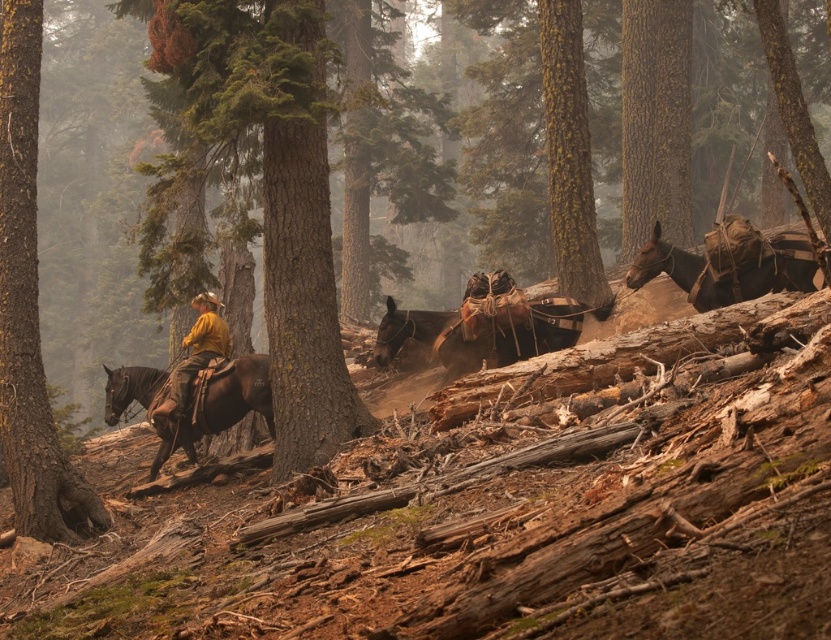
Question: Is brown leather horse at right to the left of yellow matte shirt at left from the viewer's perspective?

Choices:
 (A) yes
 (B) no

Answer: (B)

Question: Which of the following is the farthest from the observer?

Choices:
 (A) (180, 369)
 (B) (188, 449)
 (C) (559, 314)
 (D) (310, 365)

Answer: (B)

Question: Which point is farther from the camera taking this photo?

Choices:
 (A) (549, 307)
 (B) (27, 99)

Answer: (A)

Question: Can you confirm if smooth brown tree trunk at center is smaller than brown leather horse at right?

Choices:
 (A) yes
 (B) no

Answer: (A)

Question: Estimate the real-world distances between objects in this image. Which object is closer to the smooth brown tree trunk at center?

Choices:
 (A) brown rough leather horse at center
 (B) yellow matte shirt at left

Answer: (A)

Question: Can you confirm if smooth brown tree trunk at center is positioned to the right of yellow matte shirt at left?

Choices:
 (A) no
 (B) yes

Answer: (B)